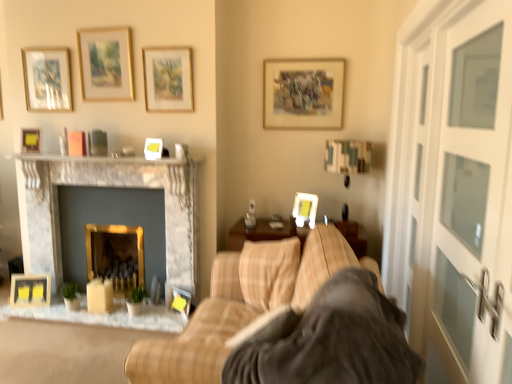
This screenshot has height=384, width=512. Describe the element at coordinates (181, 301) in the screenshot. I see `matte black picture frame at lower center, which is counted as the 3th picture frame, starting from the right` at that location.

At what (x,y) coordinates should I click in order to perform the action: click on matte black picture frame at lower center, the 8th picture frame positioned from the left. Please return your answer as a coordinate pair (x, y). The height and width of the screenshot is (384, 512). Looking at the image, I should click on (181, 301).

Find the location of a particular element. white glass door at right is located at coordinates (453, 188).

The height and width of the screenshot is (384, 512). Find the location of `wooden picture frame at upper center, marked as the ninth picture frame in a left-to-right arrangement`. wooden picture frame at upper center, marked as the ninth picture frame in a left-to-right arrangement is located at coordinates [303, 93].

This screenshot has height=384, width=512. What do you see at coordinates (100, 160) in the screenshot?
I see `white marble fireplace at upper center` at bounding box center [100, 160].

Measure the distance between matte white picture frame at upper right, the tenth picture frame from the left, and camera.

They are 3.11 meters apart.

Describe the element at coordinates (305, 209) in the screenshot. I see `matte white picture frame at upper right, the tenth picture frame from the left` at that location.

At what (x,y) coordinates should I click in order to perform the action: click on beige plaid couch at center. Please return your answer as a coordinate pair (x, y). This screenshot has height=384, width=512. Looking at the image, I should click on (242, 303).

Considering the relative sizes of matte black picture frame at lower center, the 8th picture frame positioned from the left, and wooden picture frame at center, the 6th picture frame from the right, in the image provided, is matte black picture frame at lower center, the 8th picture frame positioned from the left, thinner than wooden picture frame at center, the 6th picture frame from the right,?

No.

From a real-world perspective, between matte black picture frame at lower center, the 8th picture frame positioned from the left, and wooden picture frame at center, which is the fifth picture frame from left to right, who is vertically lower?

matte black picture frame at lower center, the 8th picture frame positioned from the left, from a real-world perspective.

From the image's perspective, which is below, matte black picture frame at lower center, the 8th picture frame positioned from the left, or wooden picture frame at center, the 6th picture frame from the right?

matte black picture frame at lower center, the 8th picture frame positioned from the left, appears lower in the image.

What's the angular difference between matte black picture frame at lower center, which is counted as the 3th picture frame, starting from the right, and wooden picture frame at center, the 6th picture frame from the right,'s facing directions?

28 degrees separate the facing orientations of matte black picture frame at lower center, which is counted as the 3th picture frame, starting from the right, and wooden picture frame at center, the 6th picture frame from the right.

Which is farther, (258, 279) or (315, 203)?

The point (315, 203) is farther.

Can you confirm if beige plaid couch at center is thinner than matte white picture frame at upper right, arranged as the first picture frame when viewed from the right?

Incorrect, the width of beige plaid couch at center is not less than that of matte white picture frame at upper right, arranged as the first picture frame when viewed from the right.

This screenshot has width=512, height=384. I want to click on studio couch located on the left of matte white picture frame at upper right, arranged as the first picture frame when viewed from the right, so click(242, 303).

From a real-world perspective, is gold metallic fireplace at center, which is the 2th fireplace from left to right, positioned above or below matte black picture frame at lower center, which is counted as the 3th picture frame, starting from the right?

gold metallic fireplace at center, which is the 2th fireplace from left to right, is situated higher than matte black picture frame at lower center, which is counted as the 3th picture frame, starting from the right, in the real world.

Considering the relative sizes of gold metallic fireplace at center, the first fireplace from the right, and matte black picture frame at lower center, the 8th picture frame positioned from the left, in the image provided, is gold metallic fireplace at center, the first fireplace from the right, bigger than matte black picture frame at lower center, the 8th picture frame positioned from the left,?

Yes, gold metallic fireplace at center, the first fireplace from the right, is bigger than matte black picture frame at lower center, the 8th picture frame positioned from the left.

Does gold metallic fireplace at center, the first fireplace from the right, appear on the left side of matte black picture frame at lower center, the 8th picture frame positioned from the left?

Yes.

Does gold metallic fireplace at center, which is the 2th fireplace from left to right, come in front of matte black picture frame at lower center, which is counted as the 3th picture frame, starting from the right?

No.

In the scene shown: Who is taller, matte yellow picture frame at upper left, which is counted as the second picture frame, starting from the left, or wooden picture frame at center, the 6th picture frame from the right?

wooden picture frame at center, the 6th picture frame from the right.

Between matte yellow picture frame at upper left, which is counted as the second picture frame, starting from the left, and wooden picture frame at center, the 6th picture frame from the right, which one appears on the right side from the viewer's perspective?

From the viewer's perspective, wooden picture frame at center, the 6th picture frame from the right, appears more on the right side.

Considering the positions of objects matte yellow picture frame at upper left, which is counted as the second picture frame, starting from the left, and wooden picture frame at center, which is the fifth picture frame from left to right, in the image provided, who is in front, matte yellow picture frame at upper left, which is counted as the second picture frame, starting from the left, or wooden picture frame at center, which is the fifth picture frame from left to right,?

Positioned in front is matte yellow picture frame at upper left, which is counted as the second picture frame, starting from the left.

From a real-world perspective, between matte yellow picture frame at upper left, placed as the 9th picture frame when sorted from right to left, and wooden picture frame at center, the 6th picture frame from the right, who is vertically lower?

wooden picture frame at center, the 6th picture frame from the right, is physically lower.

In the image, is matte glass picture frame at upper left, arranged as the third picture frame when viewed from the left, positioned in front of or behind gold metallic fireplace at center, the first fireplace from the right?

In the image, matte glass picture frame at upper left, arranged as the third picture frame when viewed from the left, appears in front of gold metallic fireplace at center, the first fireplace from the right.

Starting from the gold metallic fireplace at center, which is the 2th fireplace from left to right, which picture frame is the 1st one to the left? Please provide its 2D coordinates.

[(47, 79)]

Is matte glass picture frame at upper left, the 8th picture frame when ordered from right to left, with gold metallic fireplace at center, the first fireplace from the right?

No, matte glass picture frame at upper left, the 8th picture frame when ordered from right to left, is not beside gold metallic fireplace at center, the first fireplace from the right.

How different are the orientations of matte glass picture frame at upper left, the 8th picture frame when ordered from right to left, and gold metallic fireplace at center, the first fireplace from the right, in degrees?

They differ by 0.135 degrees in their facing directions.

From the picture: From a real-world perspective, is soft gray blanket at center on top of white glossy picture frame at center, the 5th picture frame positioned from the right?

No, from a real-world perspective, soft gray blanket at center is not above white glossy picture frame at center, the 5th picture frame positioned from the right.

Considering the sizes of objects soft gray blanket at center and white glossy picture frame at center, the 5th picture frame positioned from the right, in the image provided, who is taller, soft gray blanket at center or white glossy picture frame at center, the 5th picture frame positioned from the right,?

With more height is soft gray blanket at center.

Which is closer, (286, 342) or (145, 145)?

Positioned in front is point (286, 342).

Looking at this image, considering the sizes of objects soft gray blanket at center and white glossy picture frame at center, which appears as the sixth picture frame when viewed from the left, in the image provided, who is thinner, soft gray blanket at center or white glossy picture frame at center, which appears as the sixth picture frame when viewed from the left,?

With smaller width is white glossy picture frame at center, which appears as the sixth picture frame when viewed from the left.

Is point (126, 99) positioned in front of point (148, 155)?

No, it is behind (148, 155).

Is matte wooden picture frame at upper left, the seventh picture frame positioned from the right, located outside white glossy picture frame at center, which appears as the sixth picture frame when viewed from the left?

Yes, matte wooden picture frame at upper left, the seventh picture frame positioned from the right, is located beyond the bounds of white glossy picture frame at center, which appears as the sixth picture frame when viewed from the left.

Which is in front, matte wooden picture frame at upper left, the 4th picture frame positioned from the left, or white glossy picture frame at center, which appears as the sixth picture frame when viewed from the left?

white glossy picture frame at center, which appears as the sixth picture frame when viewed from the left, is closer to the camera.

Consider the image. Which of these two, matte wooden picture frame at upper left, the seventh picture frame positioned from the right, or white glossy picture frame at center, the 5th picture frame positioned from the right, stands taller?

With more height is matte wooden picture frame at upper left, the seventh picture frame positioned from the right.

Starting from the wooden picture frame at center, which is the fifth picture frame from left to right, which picture frame is the 7th one in front? Please provide its 2D coordinates.

[(181, 301)]

Where is `studio couch that appears below the matte white picture frame at upper right, arranged as the first picture frame when viewed from the right (from a real-world perspective)`? studio couch that appears below the matte white picture frame at upper right, arranged as the first picture frame when viewed from the right (from a real-world perspective) is located at coordinates (242, 303).

When comparing their distances from white glass door at right, does matte wooden picture frame at lower left, the 10th picture frame when ordered from right to left, or beige plaid couch at center seem further?

matte wooden picture frame at lower left, the 10th picture frame when ordered from right to left.

From the image, which object appears to be farther from white glossy picture frame at center, which appears as the sixth picture frame when viewed from the left, matte wooden picture frame at upper left, the 4th picture frame positioned from the left, or matte wooden picture frame at lower left, the 10th picture frame when ordered from right to left?

matte wooden picture frame at lower left, the 10th picture frame when ordered from right to left, is further to white glossy picture frame at center, which appears as the sixth picture frame when viewed from the left.

Based on their spatial positions, is white glass door at right or matte white picture frame at upper right, the tenth picture frame from the left, further from matte gold picture frame at upper center, which is the 7th picture frame from left to right?

white glass door at right is positioned further to the anchor matte gold picture frame at upper center, which is the 7th picture frame from left to right.

Based on their spatial positions, is white glossy picture frame at center, the 5th picture frame positioned from the right, or matte gold picture frame at upper center, which is the 7th picture frame from left to right, further from matte wooden picture frame at lower left, the 10th picture frame when ordered from right to left?

Based on the image, matte gold picture frame at upper center, which is the 7th picture frame from left to right, appears to be further to matte wooden picture frame at lower left, the 10th picture frame when ordered from right to left.

From the picture: Considering their positions, is matte wooden picture frame at lower left, the 1th picture frame when ordered from left to right, positioned further to wooden picture frame at upper center, which is the second picture frame from right to left, than white marble fireplace at upper center?

matte wooden picture frame at lower left, the 1th picture frame when ordered from left to right, is further to wooden picture frame at upper center, which is the second picture frame from right to left.

Looking at the image, which one is located closer to matte white picture frame at upper right, the tenth picture frame from the left, matte yellow picture frame at upper left, placed as the 9th picture frame when sorted from right to left, or soft gray blanket at center?

soft gray blanket at center is closer to matte white picture frame at upper right, the tenth picture frame from the left.

Looking at this image, when comparing their distances from beige plaid couch at center, does white marble fireplace at upper center or matte black picture frame at lower center, which is counted as the 3th picture frame, starting from the right, seem closer?

The object closer to beige plaid couch at center is matte black picture frame at lower center, which is counted as the 3th picture frame, starting from the right.

From the image, which object appears to be nearer to beige plaid couch at center, wooden picture frame at upper center, which is the second picture frame from right to left, or matte black picture frame at lower center, the 8th picture frame positioned from the left?

Based on the image, matte black picture frame at lower center, the 8th picture frame positioned from the left, appears to be nearer to beige plaid couch at center.

Find the location of a particular element. The image size is (512, 384). fireplace situated between marble fireplace at center, which appears as the 1th fireplace when viewed from the left, and matte white picture frame at upper right, the tenth picture frame from the left, from left to right is located at coordinates (116, 255).

Image resolution: width=512 pixels, height=384 pixels. In order to click on mantle between matte gold picture frame at upper center, which is the 7th picture frame from left to right, and marble fireplace at center, which is counted as the second fireplace, starting from the right, in the vertical direction in this screenshot , I will do `click(100, 160)`.

The image size is (512, 384). Identify the location of fireplace positioned between soft gray blanket at center and white glossy picture frame at center, which appears as the sixth picture frame when viewed from the left, from near to far. (110, 186).

Identify the location of mantle between wooden picture frame at upper center, which is the second picture frame from right to left, and matte black picture frame at lower center, the 8th picture frame positioned from the left, in the up-down direction. (100, 160).